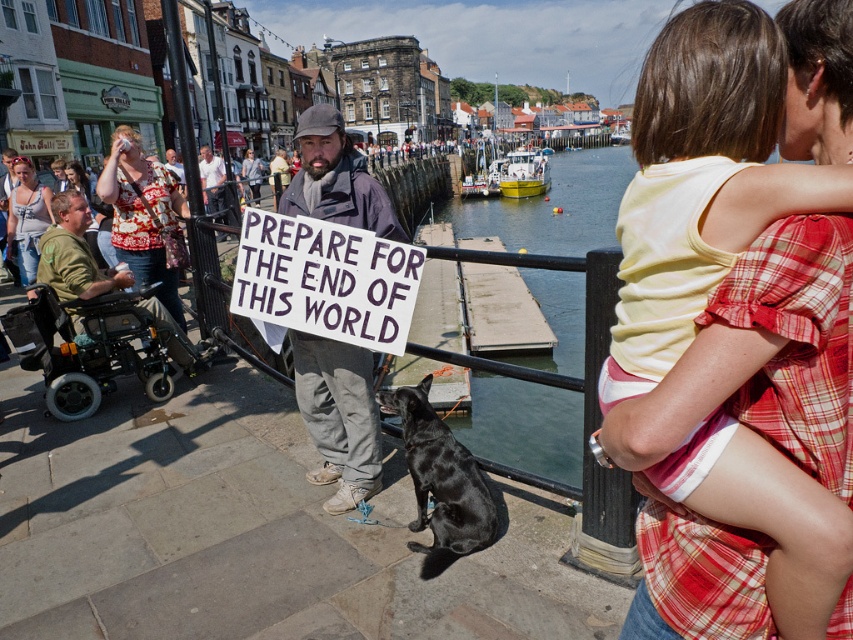
Which is more to the right, dirty gray jacket at center or black smooth dog at lower center?

Positioned to the right is black smooth dog at lower center.

How much distance is there between dirty gray jacket at center and black smooth dog at lower center?

dirty gray jacket at center and black smooth dog at lower center are 6.38 feet apart.

Between point (294, 179) and point (474, 483), which one is positioned in front?

Point (474, 483) is in front.

Locate an element on the screen. Image resolution: width=853 pixels, height=640 pixels. dirty gray jacket at center is located at coordinates (338, 416).

Is dirty gray jacket at center below green fabric wheelchair at left?

No.

In the scene shown: Who is shorter, dirty gray jacket at center or green fabric wheelchair at left?

Standing shorter between the two is dirty gray jacket at center.

Is point (322, 422) positioned behind point (184, 353)?

That is False.

The height and width of the screenshot is (640, 853). I want to click on dirty gray jacket at center, so click(338, 416).

Which is behind, point (97, 272) or point (244, 172)?

The point (244, 172) is more distant.

Where is `green fabric wheelchair at left`? green fabric wheelchair at left is located at coordinates (74, 253).

In order to click on green fabric wheelchair at left in this screenshot , I will do `click(74, 253)`.